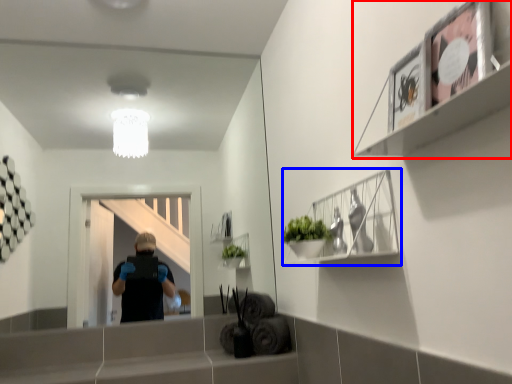
Question: Which object is further to the camera taking this photo, shelf (highlighted by a red box) or cabinet (highlighted by a blue box)?

Choices:
 (A) shelf
 (B) cabinet

Answer: (B)